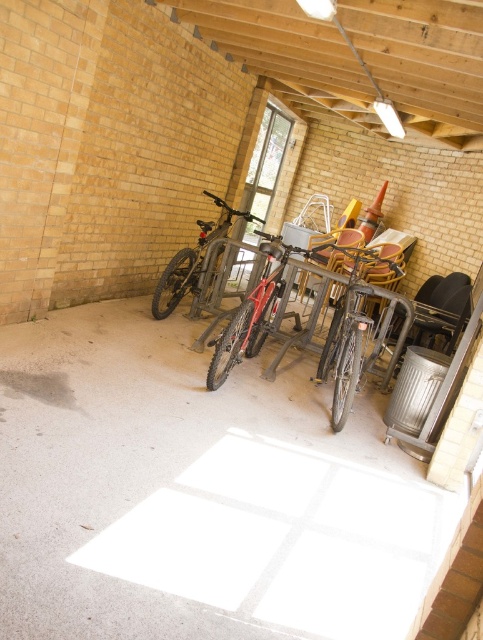
Question: Does shiny red bicycle at center have a greater width compared to shiny silver bicycle at center?

Choices:
 (A) no
 (B) yes

Answer: (B)

Question: Which point is closer to the camera?

Choices:
 (A) shiny metallic bicycle at center
 (B) shiny red bicycle at center

Answer: (B)

Question: Does white concrete floor at center appear on the left side of shiny red bicycle at center?

Choices:
 (A) yes
 (B) no

Answer: (A)

Question: Does shiny metallic bicycle at center appear on the right side of shiny silver bicycle at center?

Choices:
 (A) no
 (B) yes

Answer: (B)

Question: Estimate the real-world distances between objects in this image. Which object is farther from the shiny silver bicycle at center?

Choices:
 (A) shiny metallic bicycle at center
 (B) white concrete floor at center

Answer: (B)

Question: Which of the following is the farthest from the observer?

Choices:
 (A) coord(236,328)
 (B) coord(355,349)
 (C) coord(306,426)
 (D) coord(181,262)

Answer: (D)